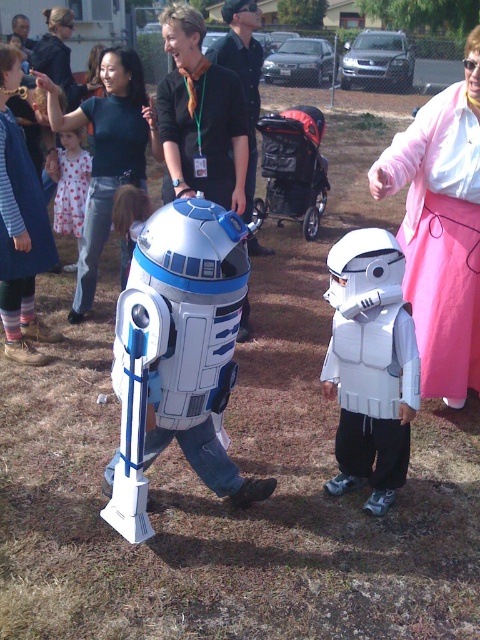
Question: Is dark blue sweater at upper center thinner than white matte robot at center?

Choices:
 (A) yes
 (B) no

Answer: (B)

Question: Is white matte helmet at upper right to the left of white matte robot at center from the viewer's perspective?

Choices:
 (A) no
 (B) yes

Answer: (A)

Question: Which object appears closest to the camera in this image?

Choices:
 (A) white matte robot at center
 (B) white matte helmet at upper right

Answer: (B)

Question: Among these objects, which one is nearest to the camera?

Choices:
 (A) polka dot dress at center
 (B) white matte helmet at upper right
 (C) black fabric stroller at center
 (D) dark blue sweater at upper center

Answer: (B)

Question: Is polka dot dress at center thinner than white matte robot at center?

Choices:
 (A) yes
 (B) no

Answer: (A)

Question: Considering the real-world distances, which object is closest to the brushed metal vest at left?

Choices:
 (A) white matte robot at center
 (B) dark blue sweater at upper center
 (C) black fabric stroller at center

Answer: (A)